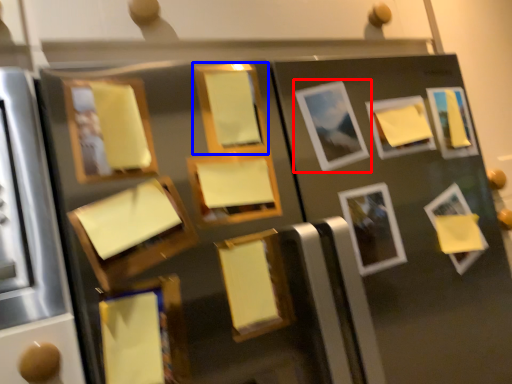
Question: Among these objects, which one is nearest to the camera, picture frame (highlighted by a red box) or picture frame (highlighted by a blue box)?

Choices:
 (A) picture frame
 (B) picture frame

Answer: (B)